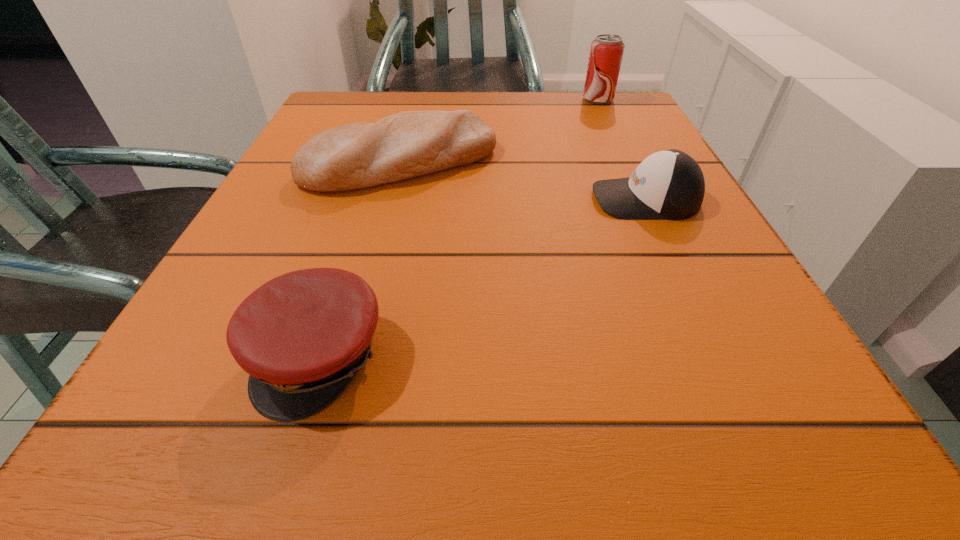
Image resolution: width=960 pixels, height=540 pixels. I want to click on the closest object to the nearest object, so click(x=410, y=144).

This screenshot has width=960, height=540. What are the coordinates of `vacant space that satisfies the following two spatial constraints: 1. on the front panel of the farther cap; 2. on the front of the nearer cap with an emblem` in the screenshot? It's located at (720, 356).

Locate an element on the screen. The image size is (960, 540). free space that satisfies the following two spatial constraints: 1. on the front panel of the farther cap; 2. on the front of the left cap with an emblem is located at coordinates (720, 356).